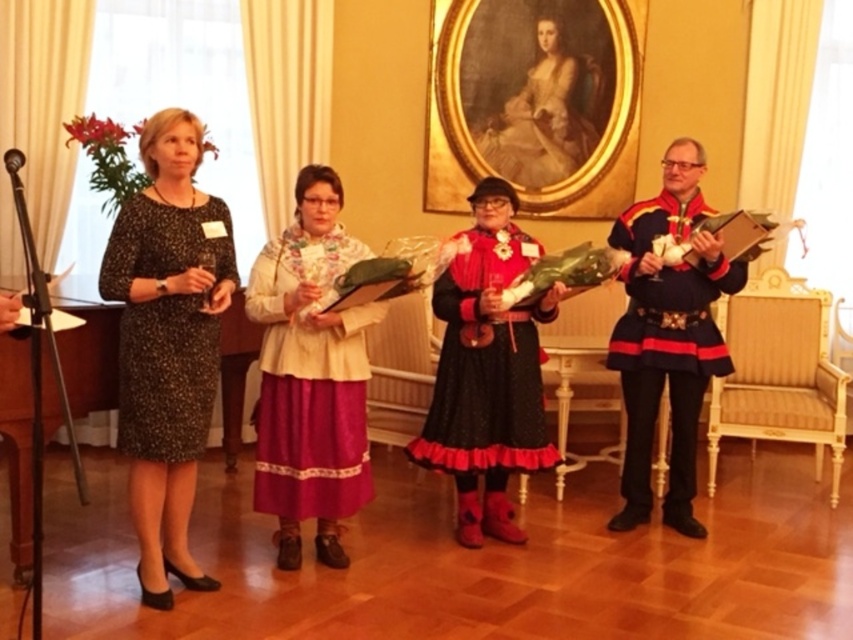
Does silky pink skirt at center have a lesser width compared to black velvet dress at center?

Indeed, silky pink skirt at center has a lesser width compared to black velvet dress at center.

The height and width of the screenshot is (640, 853). I want to click on silky pink skirt at center, so click(x=310, y=381).

Between point (328, 403) and point (534, 461), which one is positioned in front?

Positioned in front is point (328, 403).

Image resolution: width=853 pixels, height=640 pixels. I want to click on silky pink skirt at center, so click(310, 381).

Is velvet black coat at right closer to the viewer compared to matte gold dress at center?

Yes.

You are a GUI agent. You are given a task and a screenshot of the screen. Output one action in this format:
    pyautogui.click(x=<x>, y=<y>)
    Task: Click on the velvet black coat at right
    The width and height of the screenshot is (853, 640).
    Given the screenshot: What is the action you would take?
    point(668,336)

Can you confirm if velvet black coat at right is smaller than black velvet dress at center?

No.

Is point (680, 372) behind point (492, 324)?

Yes, point (680, 372) is behind point (492, 324).

At what (x,y) coordinates should I click in order to perform the action: click on velvet black coat at right. Please return your answer as a coordinate pair (x, y). Image resolution: width=853 pixels, height=640 pixels. Looking at the image, I should click on (668, 336).